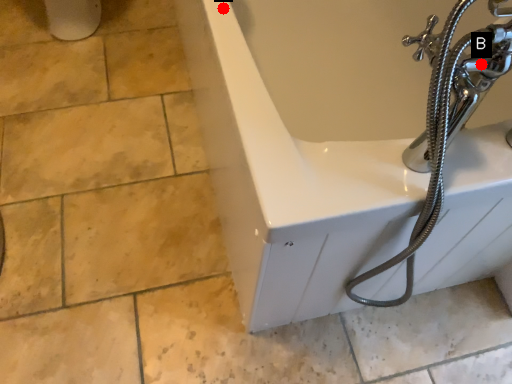
Question: Two points are circled on the image, labeled by A and B beside each circle. Which point is farther from the camera taking this photo?

Choices:
 (A) A is further
 (B) B is further

Answer: (A)